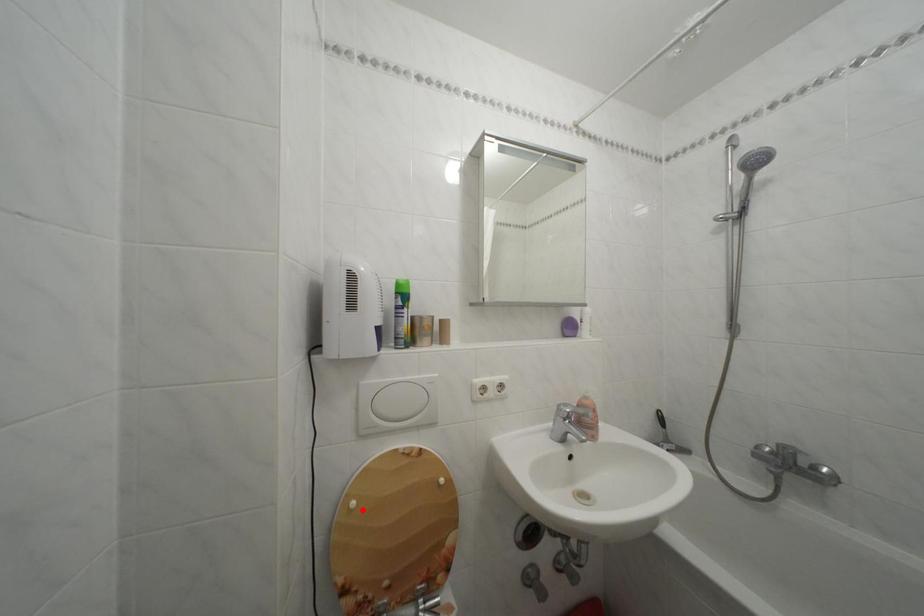
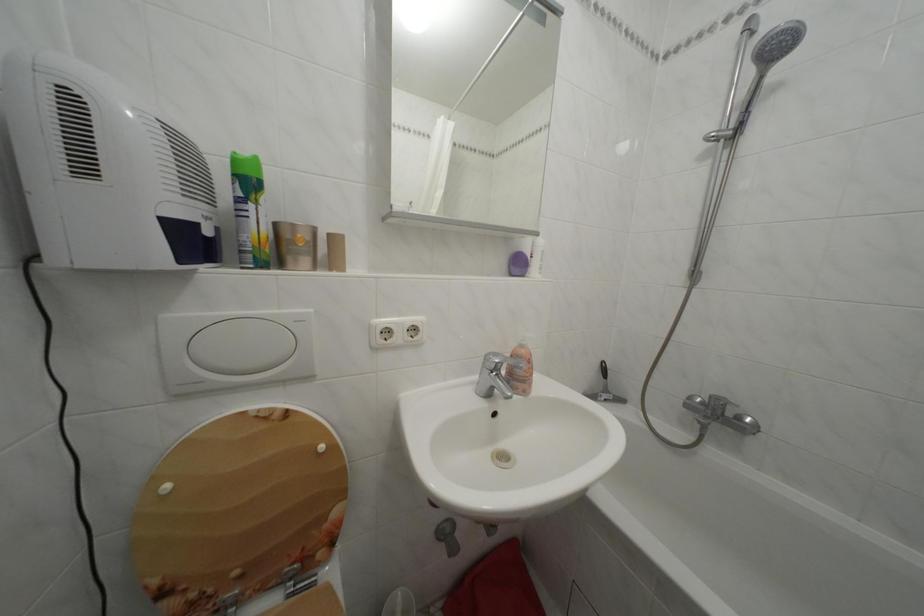
The point at the highlighted location is marked in the first image. Where is the corresponding point in the second image?

(176, 493)